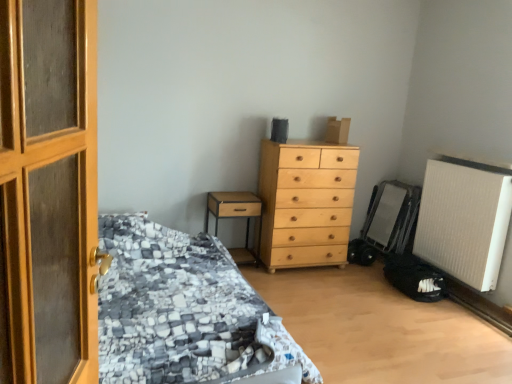
Question: From a real-world perspective, is brown wood nightstand at left positioned above or below light wood chest of drawers at center?

Choices:
 (A) below
 (B) above

Answer: (A)

Question: In terms of size, does brown wood nightstand at left appear bigger or smaller than light wood chest of drawers at center?

Choices:
 (A) small
 (B) big

Answer: (A)

Question: Which is farther from the brown wood nightstand at left?

Choices:
 (A) light wood chest of drawers at center
 (B) white textured radiator at lower right
 (C) textured gray fabric bed at left

Answer: (B)

Question: Based on their relative distances, which object is farther from the light wood chest of drawers at center?

Choices:
 (A) textured gray fabric bed at left
 (B) brown wood nightstand at left
 (C) white textured radiator at lower right

Answer: (A)